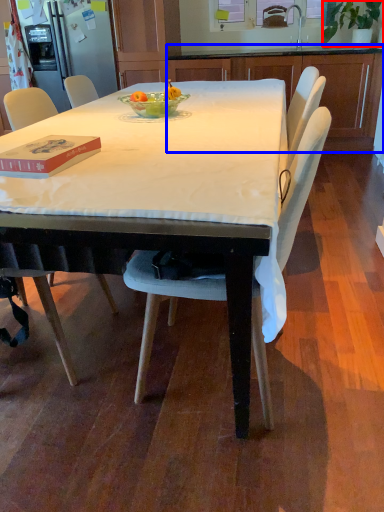
Question: Which point is further to the camera, houseplant (highlighted by a red box) or cabinetry (highlighted by a blue box)?

Choices:
 (A) houseplant
 (B) cabinetry

Answer: (B)